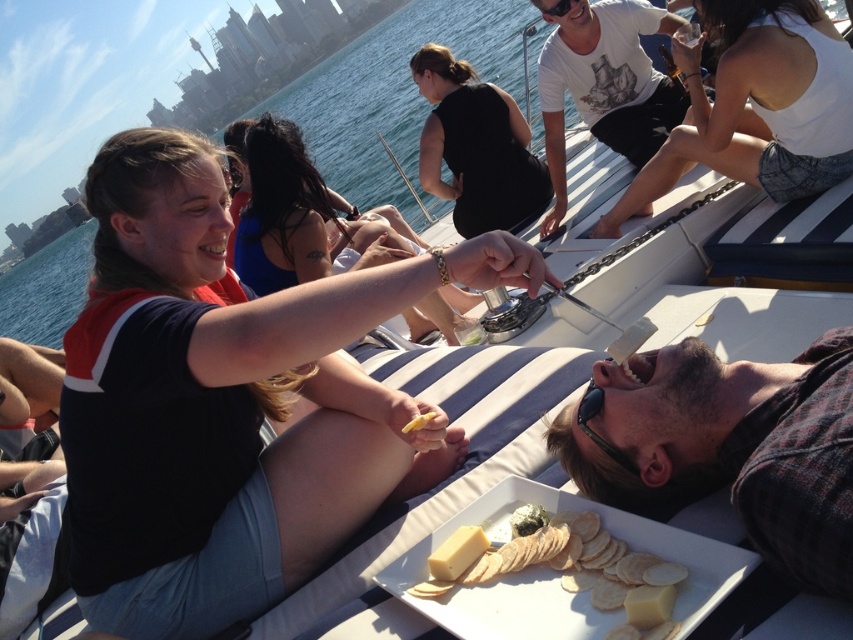
Is matte black tank top at center to the left of white creamy cheese at center from the viewer's perspective?

Correct, you'll find matte black tank top at center to the left of white creamy cheese at center.

Is matte black tank top at center wider than white creamy cheese at center?

Yes, matte black tank top at center is wider than white creamy cheese at center.

Describe the element at coordinates (297, 216) in the screenshot. I see `matte black tank top at center` at that location.

In order to click on matte black tank top at center in this screenshot , I will do `click(297, 216)`.

Does beige fabric man at lower right have a greater height compared to black matte tank top at upper center?

In fact, beige fabric man at lower right may be shorter than black matte tank top at upper center.

Can you confirm if beige fabric man at lower right is thinner than black matte tank top at upper center?

Indeed, beige fabric man at lower right has a lesser width compared to black matte tank top at upper center.

Identify the location of beige fabric man at lower right. (727, 445).

Find the location of a particular element. The image size is (853, 640). beige fabric man at lower right is located at coordinates (727, 445).

In the scene shown: Does beige fabric man at lower right have a greater height compared to matte black tank top at center?

No, beige fabric man at lower right is not taller than matte black tank top at center.

Who is taller, beige fabric man at lower right or matte black tank top at center?

matte black tank top at center is taller.

Does point (790, 490) come behind point (326, 257)?

No, it is in front of (326, 257).

Locate an element on the screen. This screenshot has width=853, height=640. beige fabric man at lower right is located at coordinates (727, 445).